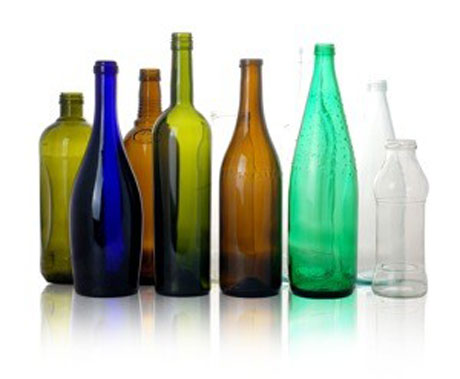
Where is `glass bottles`? The width and height of the screenshot is (460, 379). glass bottles is located at coordinates (415, 202), (373, 115), (335, 168), (254, 169), (190, 161), (144, 158), (59, 159), (96, 178).